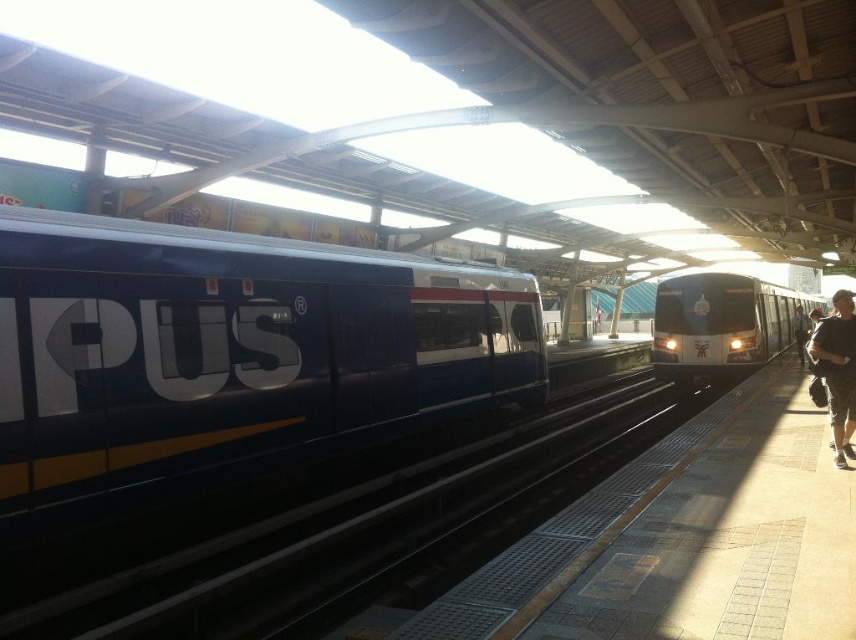
You are a passenger waiting at the train station. You see the black metal train track at center and the black leather jacket at right. Which object is closer to the right side of the platform?

The black leather jacket at right is closer to the right side of the platform because it is positioned to the right of the black metal train track at center.

You are standing at the center of the platform in the train station. You want to walk to the black metal train track at center. Which direction should you walk? Please answer with a direction like north, south, east, west, or a combination like northeast.

You should walk towards the center of the platform to reach the black metal train track at center, as it is located at point coordinates of (366, 532) which is the center area.

Consider the image. You are a passenger waiting at the train station. You see the black metal train track at center and the shiny silver train at center. Which object is positioned to the left?

The black metal train track at center is to the left of the shiny silver train at center.